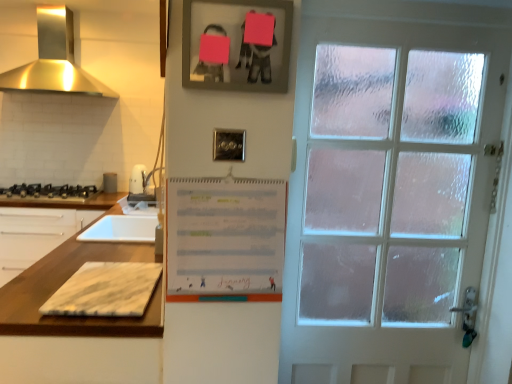
Question: Considering the relative positions of white marble cutting board at left and satin gold stainless steel exhaust hood at upper left in the image provided, is white marble cutting board at left to the left or to the right of satin gold stainless steel exhaust hood at upper left?

Choices:
 (A) left
 (B) right

Answer: (A)

Question: Is white marble cutting board at left situated inside satin gold stainless steel exhaust hood at upper left or outside?

Choices:
 (A) outside
 (B) inside

Answer: (A)

Question: Estimate the real-world distances between objects in this image. Which object is farther from the metallic silver picture frame at upper center?

Choices:
 (A) metallic silver toaster at left
 (B) white paper at center
 (C) marble cutting board at lower left
 (D) black matte gas stove at left
 (E) satin gold stainless steel exhaust hood at upper left

Answer: (E)

Question: Estimate the real-world distances between objects in this image. Which object is farther from the white paper at center?

Choices:
 (A) black matte gas stove at left
 (B) metallic silver toaster at left
 (C) white marble cutting board at left
 (D) marble cutting board at lower left
 (E) satin gold stainless steel exhaust hood at upper left

Answer: (E)